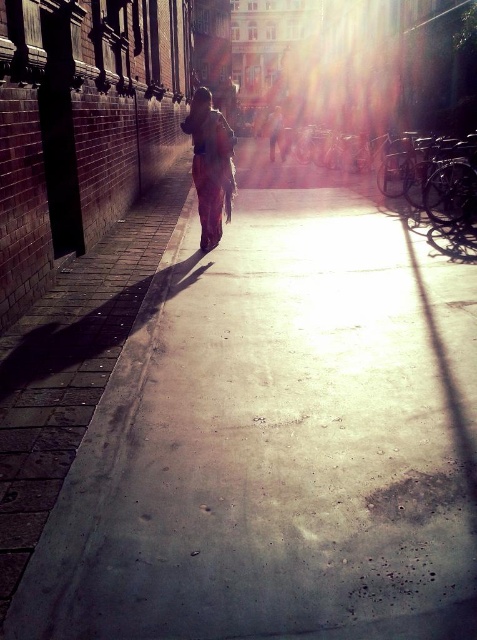
Can you confirm if matte orange pants at center is thinner than light brown leather jacket at center?

Yes, matte orange pants at center is thinner than light brown leather jacket at center.

Which of these two, matte orange pants at center or light brown leather jacket at center, stands shorter?

Standing shorter between the two is matte orange pants at center.

Which is behind, point (186, 128) or point (279, 108)?

The point (279, 108) is behind.

At what (x,y) coordinates should I click in order to perform the action: click on matte orange pants at center. Please return your answer as a coordinate pair (x, y). The width and height of the screenshot is (477, 640). Looking at the image, I should click on [210, 164].